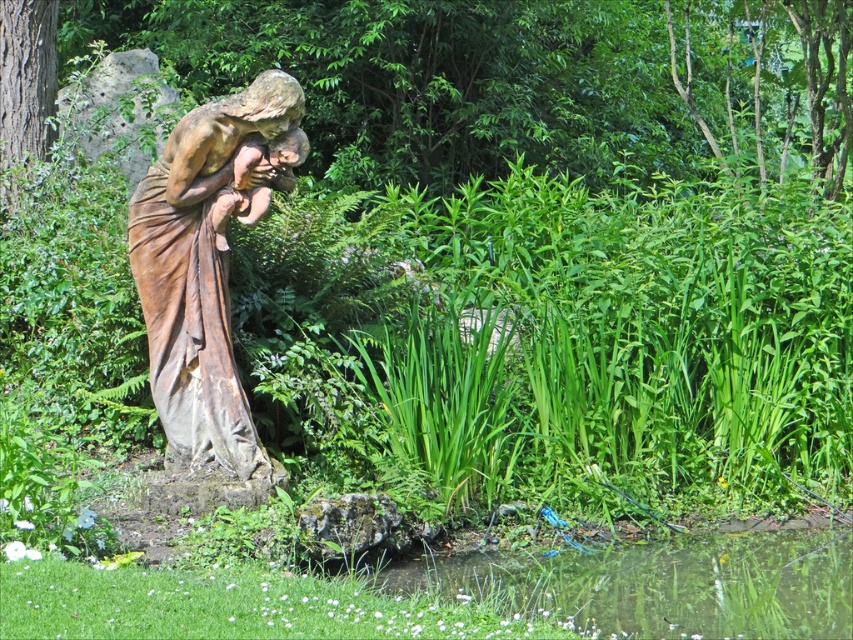
You are a drone operator trying to capture a photo of the brown stone statue at center. The statue is marked by the point coordinates at point (207, 264). Your drone has a camera with a 120 degree field of view. If you position your drone directly above the statue, will the entire statue fit within the camera frame?

The brown stone statue at center is represented by point (207, 264), so positioning the drone directly above this point would center the statue in the camera frame. Since the camera has a 120 degree field of view, which is wide enough to encompass the statue, the entire statue should fit within the frame.

You are a gardener who needs to water the plants near the brown stone statue at center and the clear water at bottom right. Which object is closer to the water source located at the bottom right?

The clear water at bottom right is the water source itself, so it is already at the bottom right. The brown stone statue at center is to the left of it, meaning the statue is farther from the water source than the water source itself. Therefore, the clear water at bottom right is closer to the water source.

You are a painter standing at the edge of the garden, looking towards the brown stone statue at center and the clear water at bottom right. Which object is closer to you?

The brown stone statue at center is closer to you because it is further to the viewer than the clear water at bottom right.